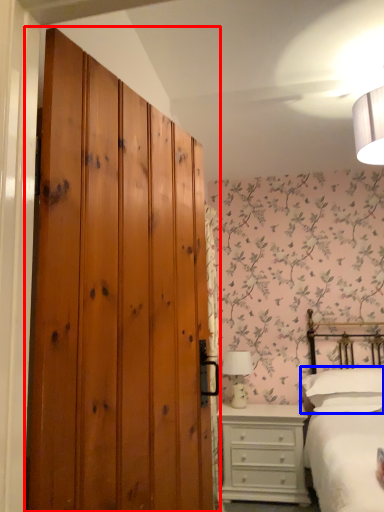
Question: Which point is closer to the camera, door (highlighted by a red box) or pillow (highlighted by a blue box)?

Choices:
 (A) door
 (B) pillow

Answer: (A)